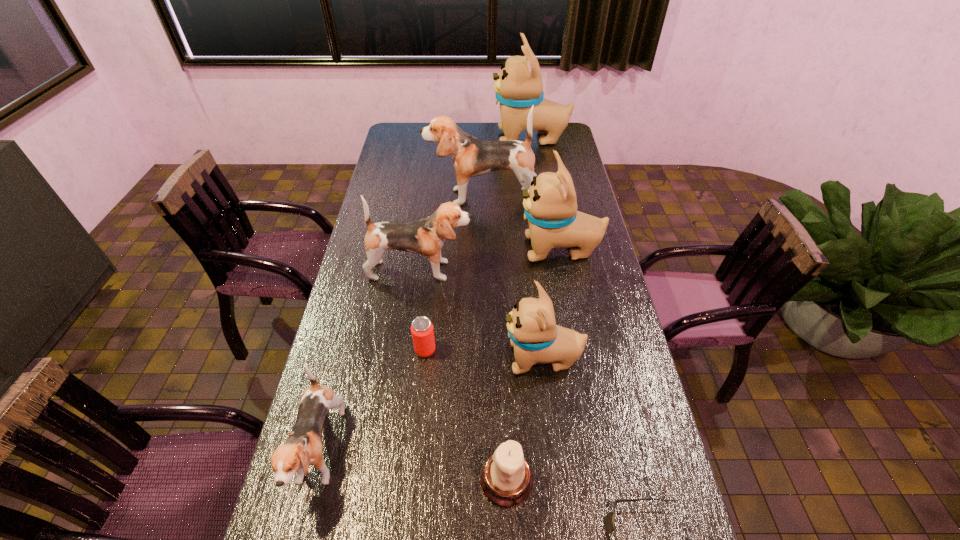
Where is `the farthest beige puppy`? the farthest beige puppy is located at coordinates (518, 87).

Where is `the farthest puppy`? the farthest puppy is located at coordinates (518, 87).

The height and width of the screenshot is (540, 960). I want to click on the second farthest object, so click(x=471, y=157).

The width and height of the screenshot is (960, 540). Identify the location of the second farthest puppy. (471, 157).

Identify the location of the second smallest beige puppy. This screenshot has width=960, height=540. (550, 204).

This screenshot has width=960, height=540. In order to click on the second farthest brown puppy in this screenshot , I will do `click(426, 237)`.

At what (x,y) coordinates should I click in order to perform the action: click on the nearest beige puppy. Please return your answer as a coordinate pair (x, y). Looking at the image, I should click on (536, 338).

The image size is (960, 540). What are the coordinates of `the second nearest puppy` in the screenshot? It's located at (536, 338).

Where is `the nearest brown puppy`? the nearest brown puppy is located at coordinates (303, 447).

Where is `the smallest brown puppy`? The height and width of the screenshot is (540, 960). the smallest brown puppy is located at coordinates (303, 447).